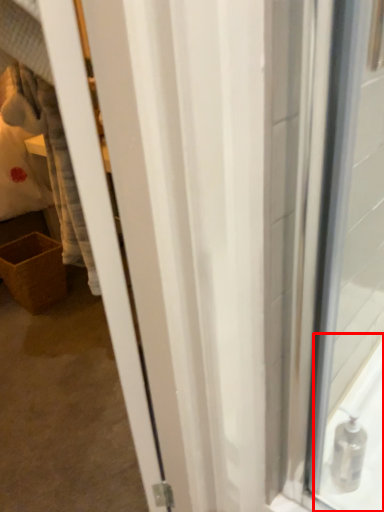
Question: Observing the image, what is the correct spatial positioning of bath (annotated by the red box) in reference to basket?

Choices:
 (A) right
 (B) left

Answer: (A)